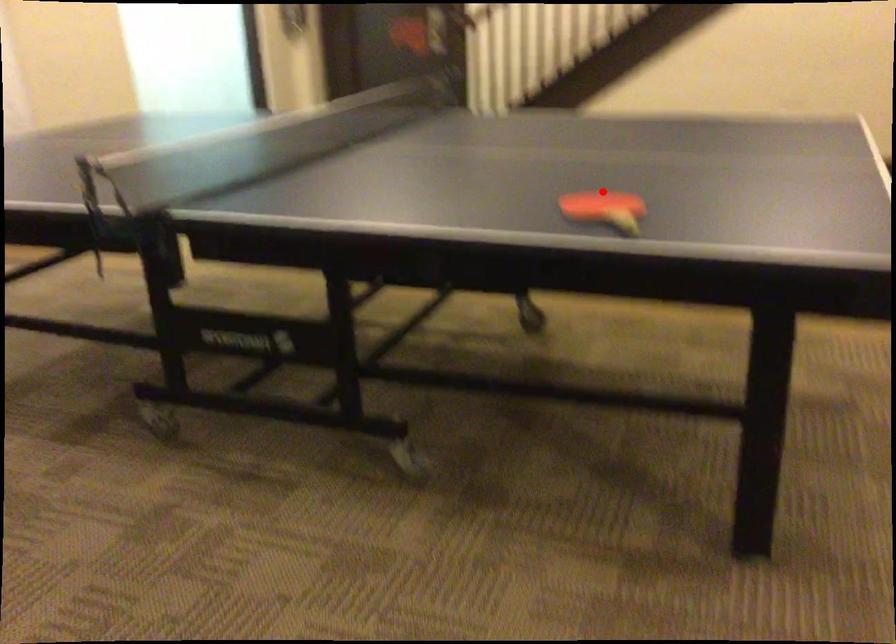
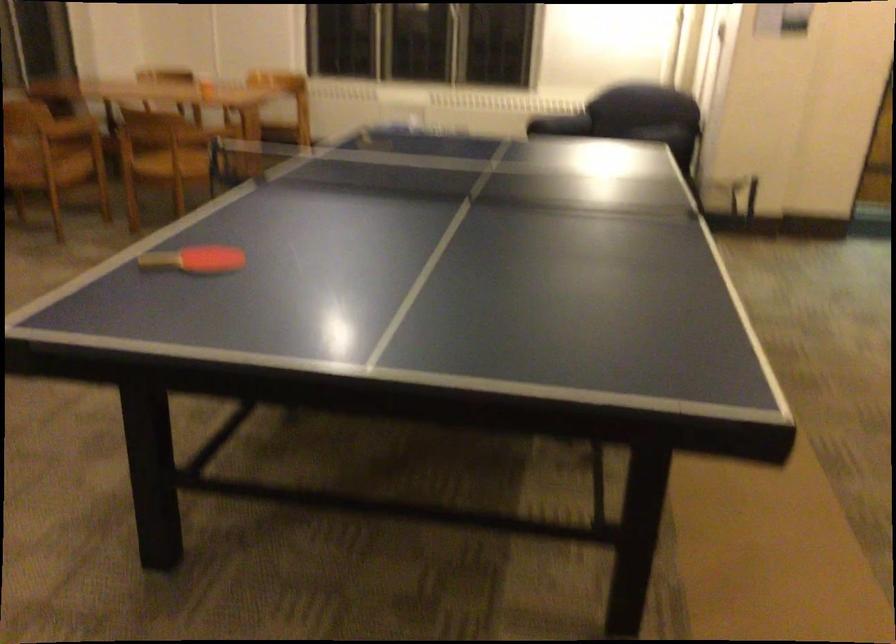
Question: I am providing you with two images of the same scene from different viewpoints. In image1, a red point is highlighted. Considering the same 3D point in image2, which of the following is correct?

Choices:
 (A) It is closer
 (B) It is farther

Answer: (B)